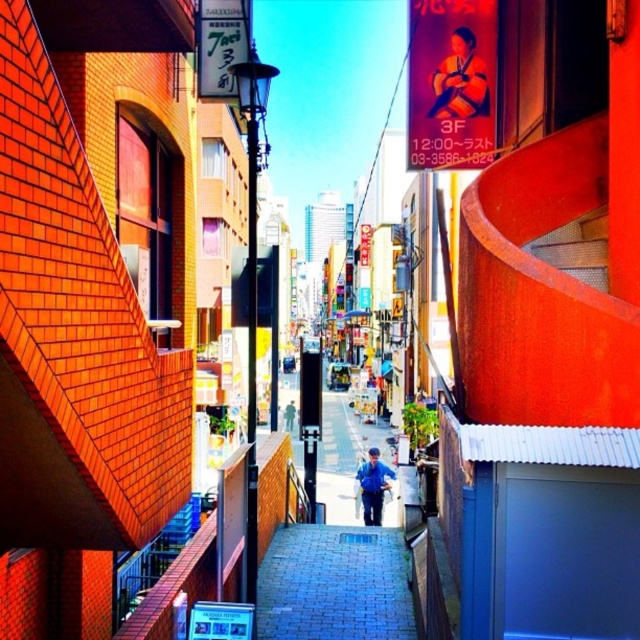
Does blue brick pavement at center come in front of blue fabric jacket at center?

Yes, it is.

Is blue brick pavement at center thinner than blue fabric jacket at center?

In fact, blue brick pavement at center might be wider than blue fabric jacket at center.

You are a GUI agent. You are given a task and a screenshot of the screen. Output one action in this format:
    pyautogui.click(x=<x>, y=<y>)
    Task: Click on the blue brick pavement at center
    
    Given the screenshot: What is the action you would take?
    pyautogui.click(x=333, y=584)

Who is positioned more to the right, blue brick pavement at center or silky kimono at center?

From the viewer's perspective, silky kimono at center appears more on the right side.

Which is below, blue brick pavement at center or silky kimono at center?

blue brick pavement at center is lower down.

Is point (400, 628) more distant than point (486, 100)?

No, it is not.

Image resolution: width=640 pixels, height=640 pixels. Find the location of `blue brick pavement at center`. blue brick pavement at center is located at coordinates (333, 584).

Can you confirm if silky kimono at center is wider than blue fabric jacket at center?

Correct, the width of silky kimono at center exceeds that of blue fabric jacket at center.

Is silky kimono at center bigger than blue fabric jacket at center?

Yes.

Image resolution: width=640 pixels, height=640 pixels. I want to click on silky kimono at center, so click(x=460, y=81).